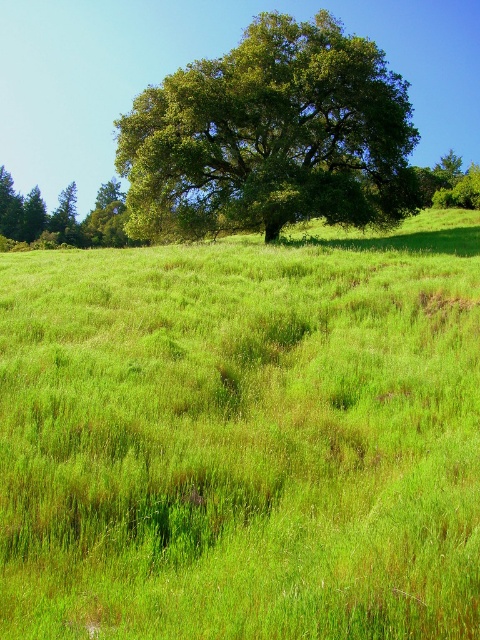
Question: Which of the following is the closest to the observer?

Choices:
 (A) green grassy pasture at center
 (B) green leafy tree at center

Answer: (A)

Question: Which of the following is the closest to the observer?

Choices:
 (A) green grassy pasture at center
 (B) green leafy tree at center

Answer: (A)

Question: Which point is closer to the camera?

Choices:
 (A) green leafy tree at center
 (B) green leafy tree at upper left
 (C) green grassy pasture at center

Answer: (C)

Question: Can you confirm if green leafy tree at center is smaller than green leafy tree at upper left?

Choices:
 (A) no
 (B) yes

Answer: (B)

Question: From the image, what is the correct spatial relationship of green grassy pasture at center in relation to green leafy tree at center?

Choices:
 (A) above
 (B) below

Answer: (B)

Question: Can you confirm if green leafy tree at center is thinner than green leafy tree at upper left?

Choices:
 (A) no
 (B) yes

Answer: (B)